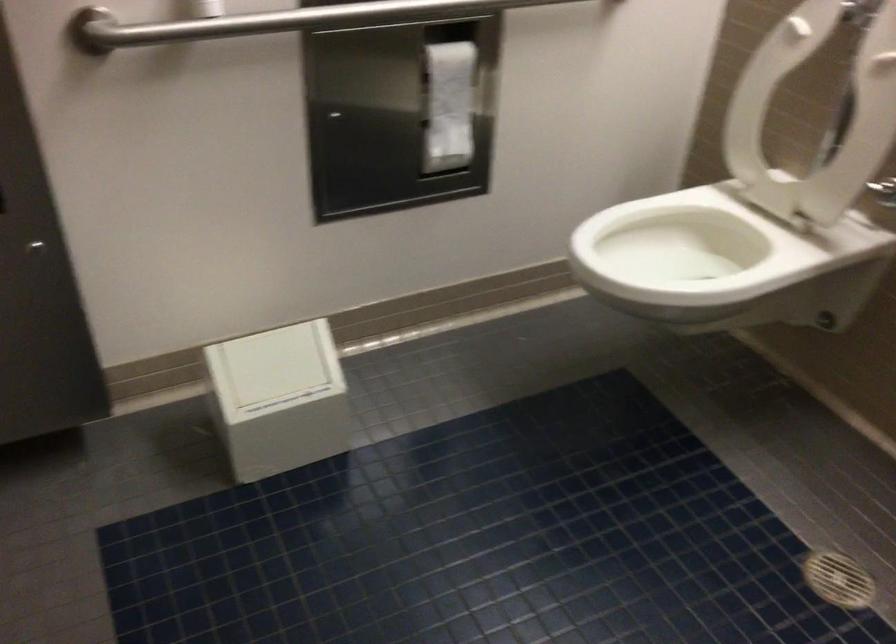
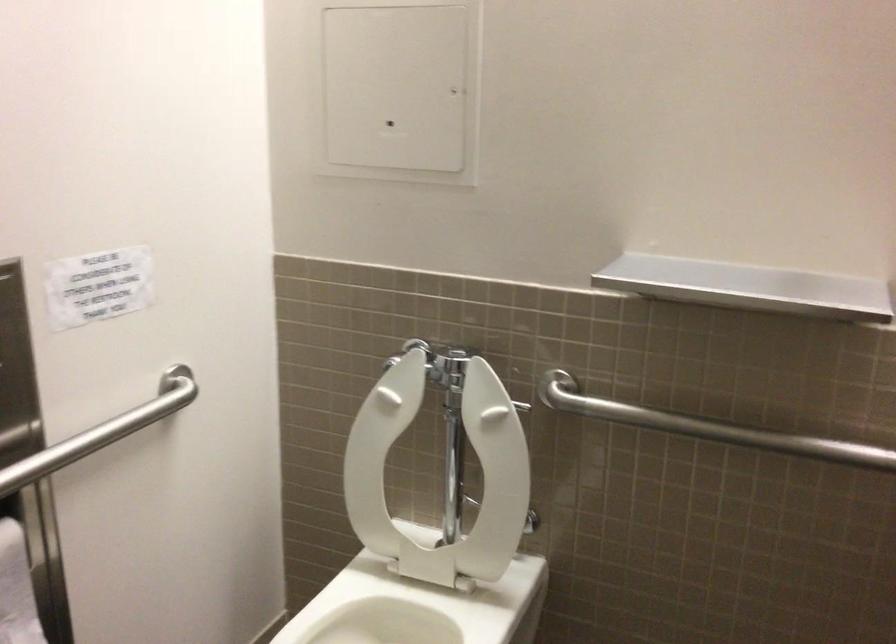
Question: The images are taken continuously from a first-person perspective. In which direction is your viewpoint rotating?

Choices:
 (A) Left
 (B) Right
 (C) Up
 (D) Down

Answer: (B)